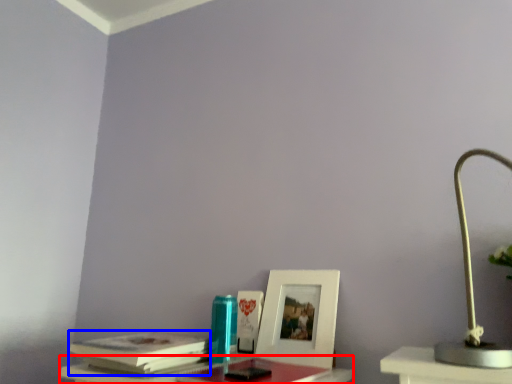
Question: Which of the following is the farthest to the observer, table (highlighted by a red box) or paperback book (highlighted by a blue box)?

Choices:
 (A) table
 (B) paperback book

Answer: (B)